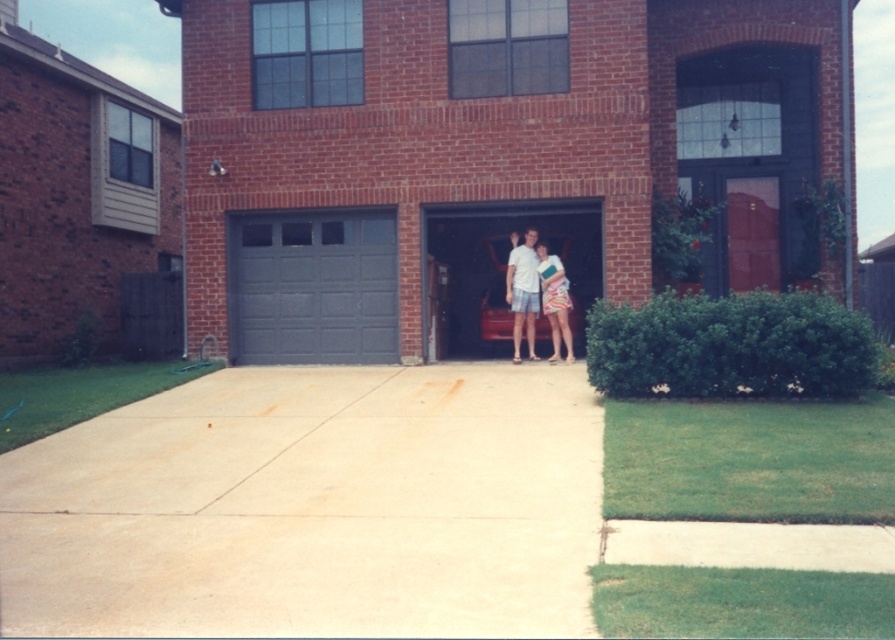
Can you confirm if beige concrete driveway at center is smaller than gray matte garage door at left?

Incorrect, beige concrete driveway at center is not smaller in size than gray matte garage door at left.

Does beige concrete driveway at center have a lesser width compared to gray matte garage door at left?

No, beige concrete driveway at center is not thinner than gray matte garage door at left.

Who is more distant from viewer, (115, 428) or (240, 324)?

Point (240, 324)

Locate an element on the screen. beige concrete driveway at center is located at coordinates (313, 508).

Is white cotton shirt at center closer to camera compared to striped fabric dress at center?

No, white cotton shirt at center is behind striped fabric dress at center.

Find the location of a particular element. white cotton shirt at center is located at coordinates [x=522, y=291].

You are a GUI agent. You are given a task and a screenshot of the screen. Output one action in this format:
    pyautogui.click(x=<x>, y=<y>)
    Task: Click on the white cotton shirt at center
    The height and width of the screenshot is (640, 895).
    Given the screenshot: What is the action you would take?
    pyautogui.click(x=522, y=291)

Is point (493, 236) closer to viewer compared to point (530, 337)?

No.

Does metallic gray garage door at center have a greater height compared to matte white shorts at center?

No, metallic gray garage door at center is not taller than matte white shorts at center.

Where is `metallic gray garage door at center`? Image resolution: width=895 pixels, height=640 pixels. metallic gray garage door at center is located at coordinates (501, 266).